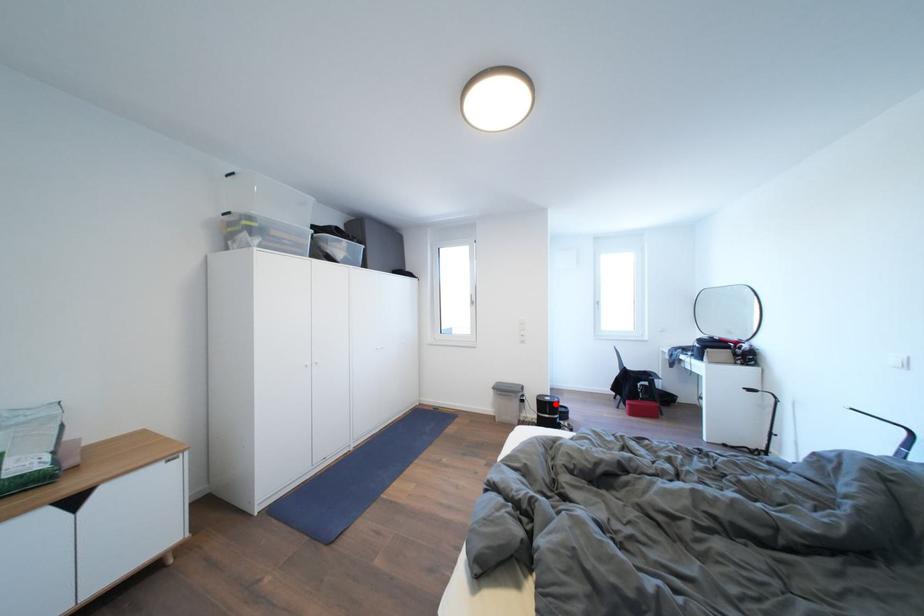
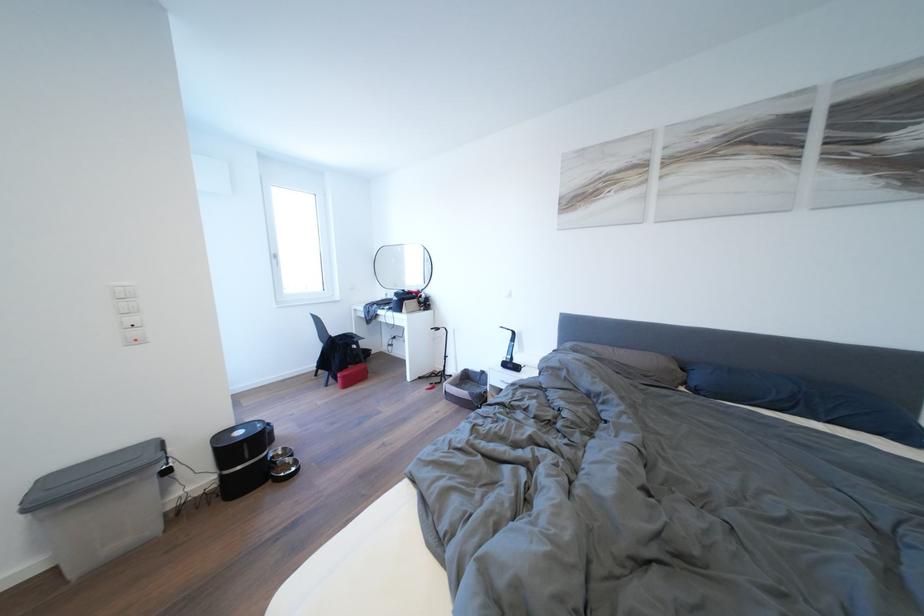
Question: I am providing you with two images of the same scene from different viewpoints. Given a red point in image1, look at the same physical point in image2. Is it:

Choices:
 (A) Closer to the viewpoint
 (B) Farther from the viewpoint

Answer: (A)